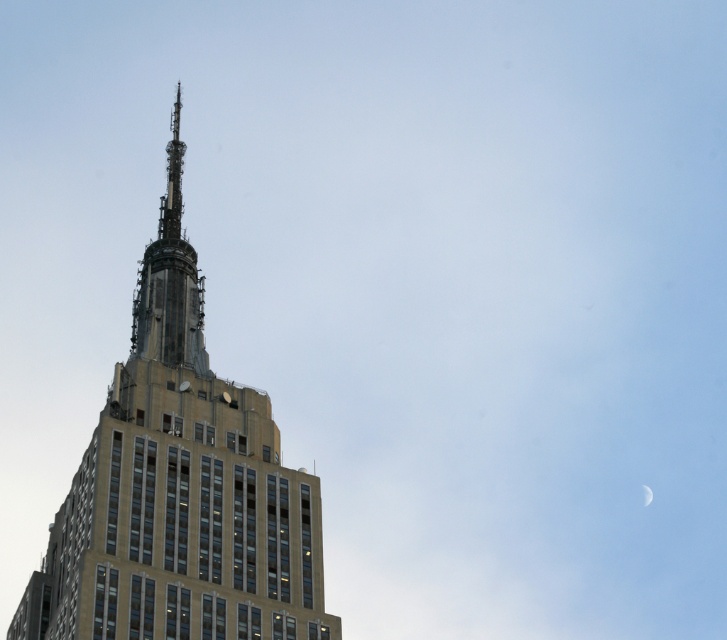
Looking at the Empire State Building from this angle, you notice the beige stone tower at center and the silvery metallic crescent at upper right. Which object is situated to the left of the other?

The beige stone tower at center is positioned on the left side of silvery metallic crescent at upper right.

You are standing in front of the Empire State Building and notice the beige stone tower at center and the silvery metallic crescent at upper right. Which object would appear larger to you based on their positions?

The beige stone tower at center appears larger because it is closer to the viewer than the silvery metallic crescent at upper right.

You are standing at the base of the Empire State Building and looking up at the image. There are two points marked on the building facade. The first point is at coordinates point (145, 256) and the second is at point (643, 492). Which point is closer to your viewpoint?

Point (145, 256) is in front of point (643, 492), so it is closer to your viewpoint.